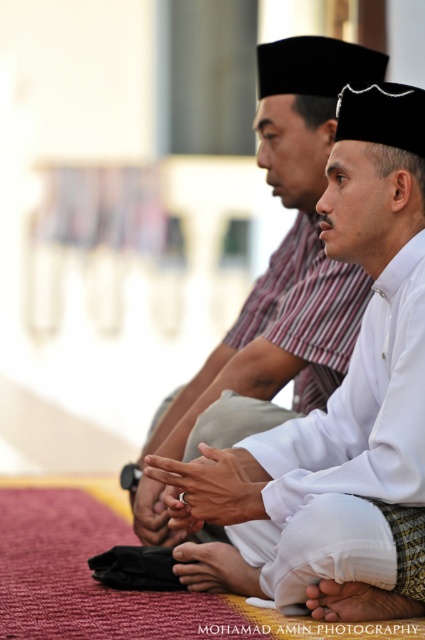
Question: Does white matte shirt at center have a greater width compared to white matte hand at lower center?

Choices:
 (A) yes
 (B) no

Answer: (A)

Question: Is white matte shirt at center to the left of white matte hand at lower center from the viewer's perspective?

Choices:
 (A) no
 (B) yes

Answer: (B)

Question: Does white matte ring at center lie behind white matte hand at center?

Choices:
 (A) no
 (B) yes

Answer: (A)

Question: Which point is closer to the camera?

Choices:
 (A) (221, 451)
 (B) (260, 65)

Answer: (A)

Question: Which object appears closest to the camera in this image?

Choices:
 (A) white matte hand at lower center
 (B) white matte ring at center

Answer: (B)

Question: Which point is farther from the camera taking this photo?

Choices:
 (A) (278, 589)
 (B) (238, 561)
 (C) (147, 468)
 (D) (391, 609)

Answer: (B)